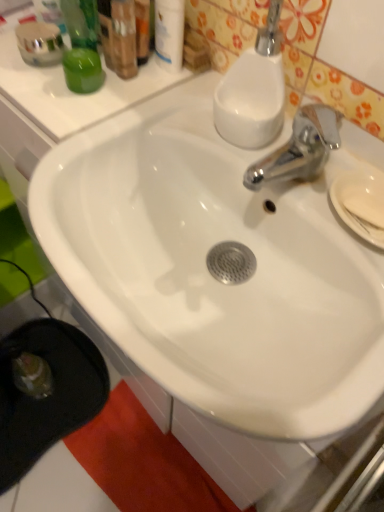
Where is `free space in front of white glossy soap dispenser at upper right`? free space in front of white glossy soap dispenser at upper right is located at coordinates (281, 193).